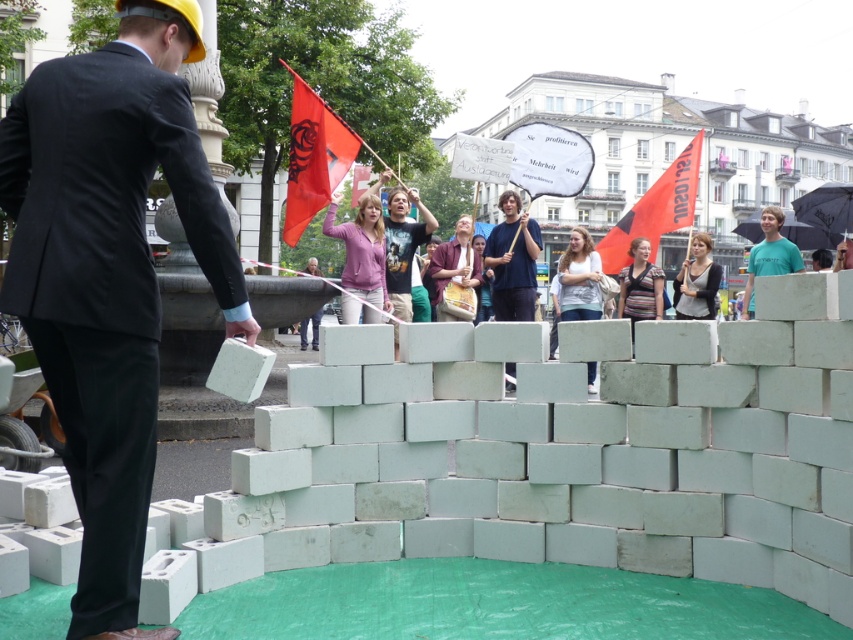
Question: Which object appears farthest from the camera in this image?

Choices:
 (A) black fabric shirt at center
 (B) red fabric flag at upper center

Answer: (B)

Question: In this image, where is denim jacket at center located relative to green matte t-shirt at center?

Choices:
 (A) left
 (B) right

Answer: (A)

Question: Based on their relative distances, which object is farther from the dark blue shirt at center?

Choices:
 (A) denim jacket at center
 (B) black fabric shirt at center
 (C) wooden drum at center

Answer: (B)

Question: Which of the following is the closest to the observer?

Choices:
 (A) wooden drum at center
 (B) matte black suit at center
 (C) dark blue shirt at center
 (D) black fabric shirt at center

Answer: (B)

Question: Can you confirm if orange fabric flag at upper right is wider than green matte t-shirt at center?

Choices:
 (A) no
 (B) yes

Answer: (A)

Question: Does wooden drum at center appear on the right side of black fabric shirt at center?

Choices:
 (A) yes
 (B) no

Answer: (B)